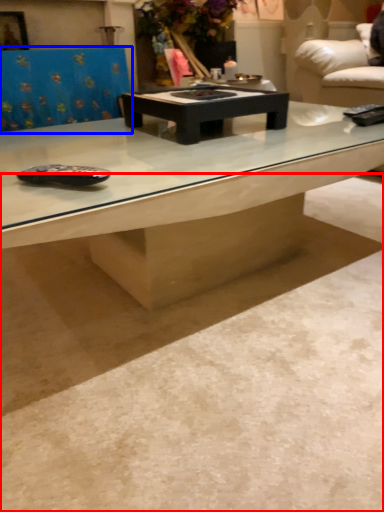
Question: Which object appears closest to the camera in this image, concrete (highlighted by a red box) or swivel chair (highlighted by a blue box)?

Choices:
 (A) concrete
 (B) swivel chair

Answer: (A)